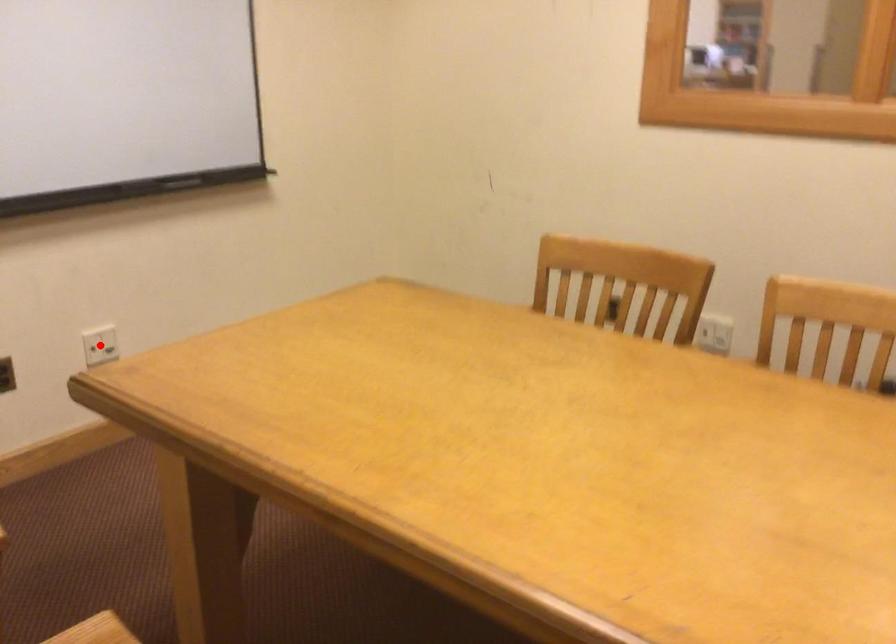
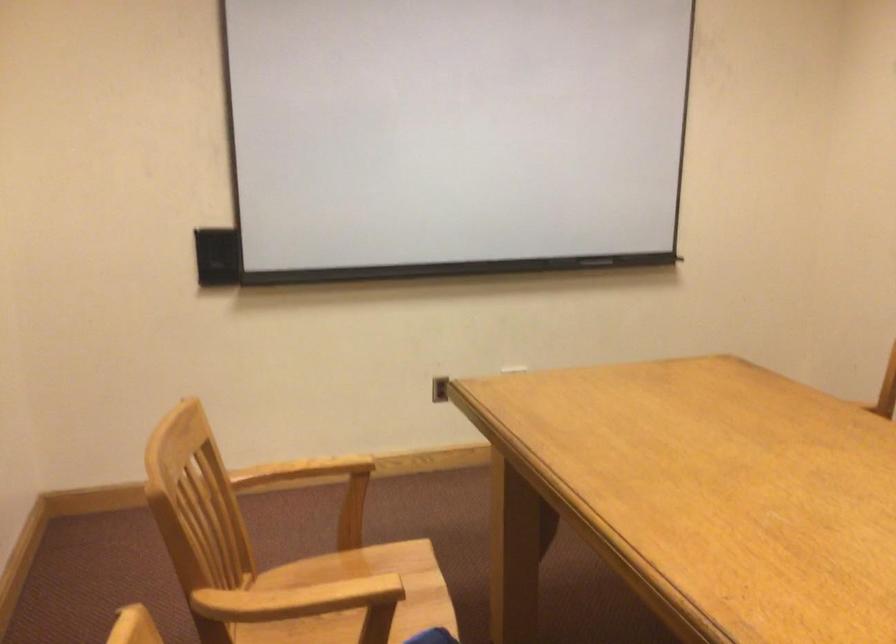
Question: I am providing you with two images of the same scene from different viewpoints. A red point is marked on the first image. At the location where the point appears in image 1, is it still visible in image 2?

Choices:
 (A) Yes
 (B) No

Answer: (B)